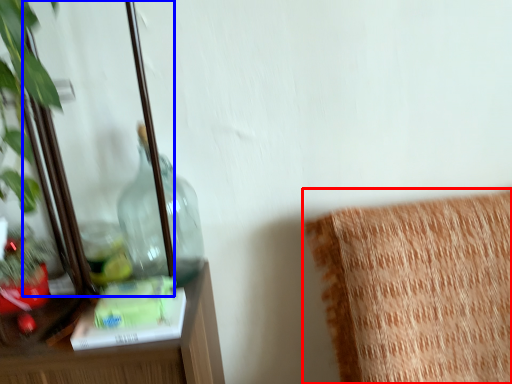
Question: Among these objects, which one is nearest to the camera, furniture (highlighted by a red box) or mirror (highlighted by a blue box)?

Choices:
 (A) furniture
 (B) mirror

Answer: (B)